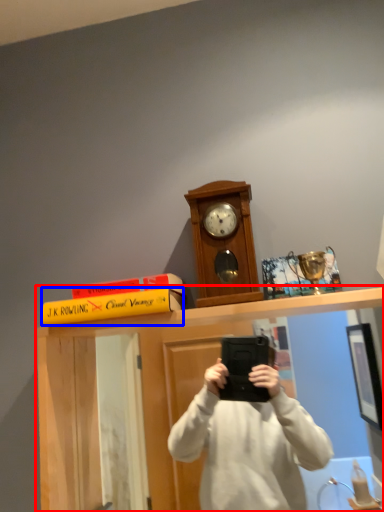
Question: Which object is further to the camera taking this photo, vanity (highlighted by a red box) or book (highlighted by a blue box)?

Choices:
 (A) vanity
 (B) book

Answer: (B)